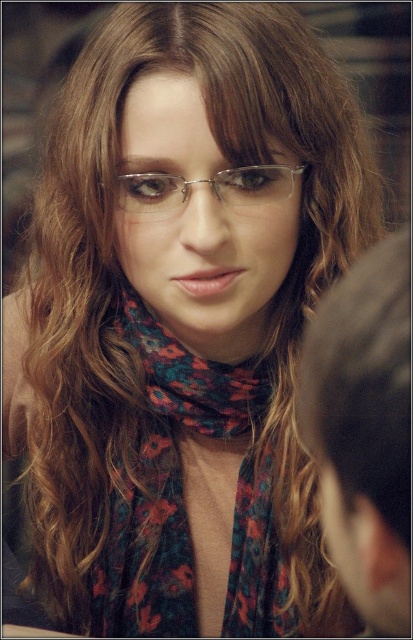
Question: Can you confirm if floral print scarf at center is smaller than brown hair at upper right?

Choices:
 (A) yes
 (B) no

Answer: (A)

Question: Which point is closer to the camera taking this photo?

Choices:
 (A) (275, 188)
 (B) (251, 577)

Answer: (A)

Question: Does floral print scarf at center appear over clear plastic glasses at center?

Choices:
 (A) no
 (B) yes

Answer: (A)

Question: Among these objects, which one is nearest to the camera?

Choices:
 (A) floral print scarf at center
 (B) brown hair at upper right

Answer: (B)

Question: Does floral print scarf at center have a lesser width compared to brown hair at upper right?

Choices:
 (A) no
 (B) yes

Answer: (A)

Question: Which point is closer to the camera taking this photo?

Choices:
 (A) (220, 177)
 (B) (356, 609)

Answer: (A)